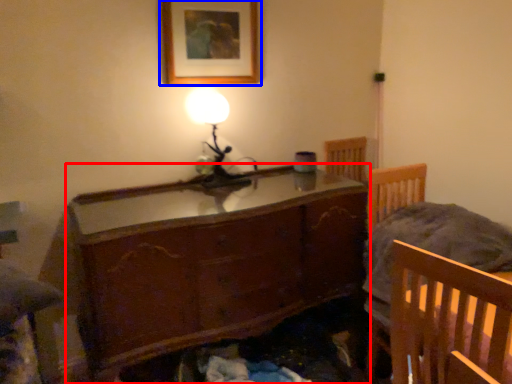
Question: Among these objects, which one is nearest to the camera, chest of drawers (highlighted by a red box) or picture frame (highlighted by a blue box)?

Choices:
 (A) chest of drawers
 (B) picture frame

Answer: (A)